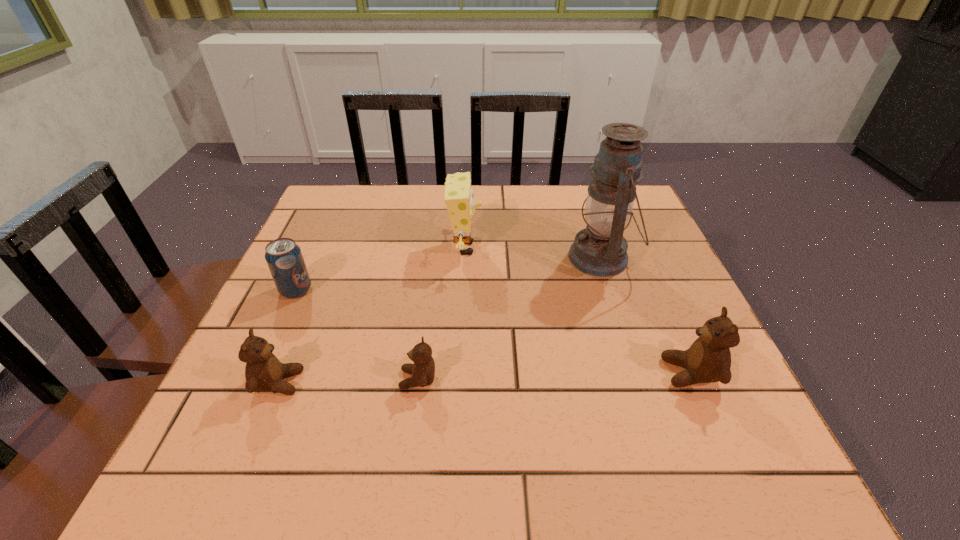
I want to click on empty space that is in between the leftmost teddy bear and the pop soda, so click(287, 336).

This screenshot has width=960, height=540. Find the location of `empty location between the second tallest teddy bear and the oil lamp`. empty location between the second tallest teddy bear and the oil lamp is located at coordinates (440, 320).

Image resolution: width=960 pixels, height=540 pixels. I want to click on free space between the pop soda and the tallest object, so click(448, 274).

This screenshot has width=960, height=540. In order to click on vacant region between the pop soda and the third tallest object in this screenshot , I will do `click(493, 332)`.

Locate which object is the closest to the shortest teddy bear. Please provide its 2D coordinates. Your answer should be formatted as a tuple, i.e. [(x, y)], where the tuple contains the x and y coordinates of a point satisfying the conditions above.

[(264, 372)]

Find the location of a particular element. the second closest object to the fourth shortest object is located at coordinates (458, 196).

You are a GUI agent. You are given a task and a screenshot of the screen. Output one action in this format:
    pyautogui.click(x=<x>, y=<y>)
    Task: Click on the teddy bear that is the second closest to the rightmost teddy bear
    The height and width of the screenshot is (540, 960).
    Given the screenshot: What is the action you would take?
    pyautogui.click(x=264, y=372)

Identify which teddy bear is located as the nearest to the fourth shortest object. Please provide its 2D coordinates. Your answer should be formatted as a tuple, i.e. [(x, y)], where the tuple contains the x and y coordinates of a point satisfying the conditions above.

[(423, 370)]

The height and width of the screenshot is (540, 960). In order to click on vacant space that satisfies the following two spatial constraints: 1. on the face of the sponge; 2. on the front side of the pop soda in this screenshot , I will do `click(464, 291)`.

Locate an element on the screen. The width and height of the screenshot is (960, 540). vacant space that satisfies the following two spatial constraints: 1. on the back side of the oil lamp; 2. on the face of the sponge is located at coordinates (598, 248).